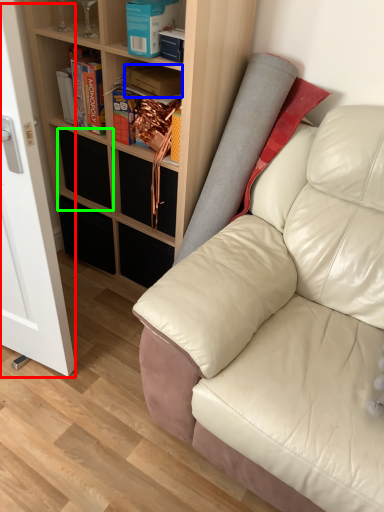
Question: Which is farther away from glass door (highlighted by a red box)? book (highlighted by a blue box) or drawer (highlighted by a green box)?

Choices:
 (A) book
 (B) drawer

Answer: (A)